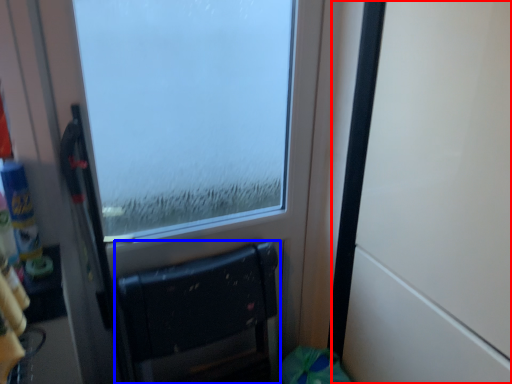
Question: Which point is closer to the camera, door (highlighted by a red box) or furniture (highlighted by a blue box)?

Choices:
 (A) door
 (B) furniture

Answer: (A)